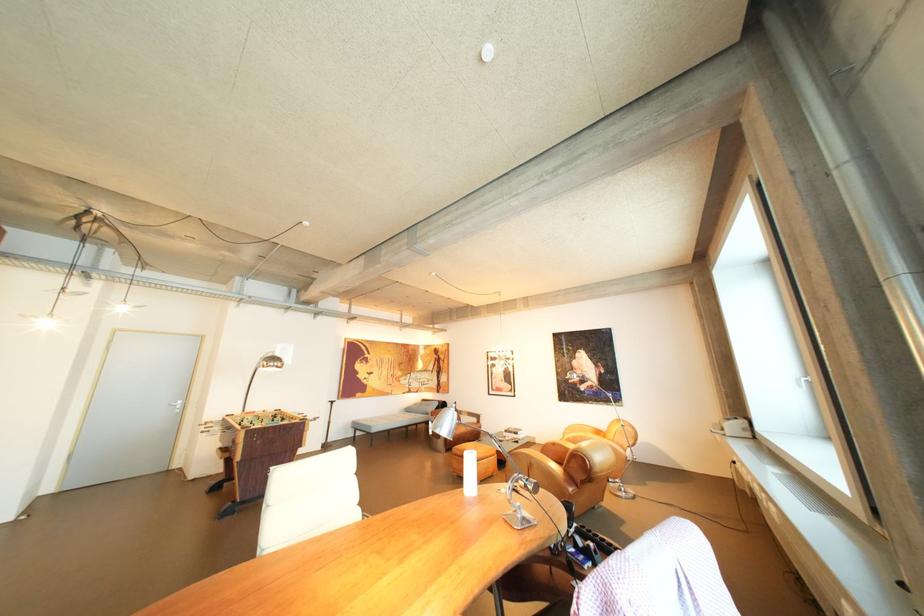
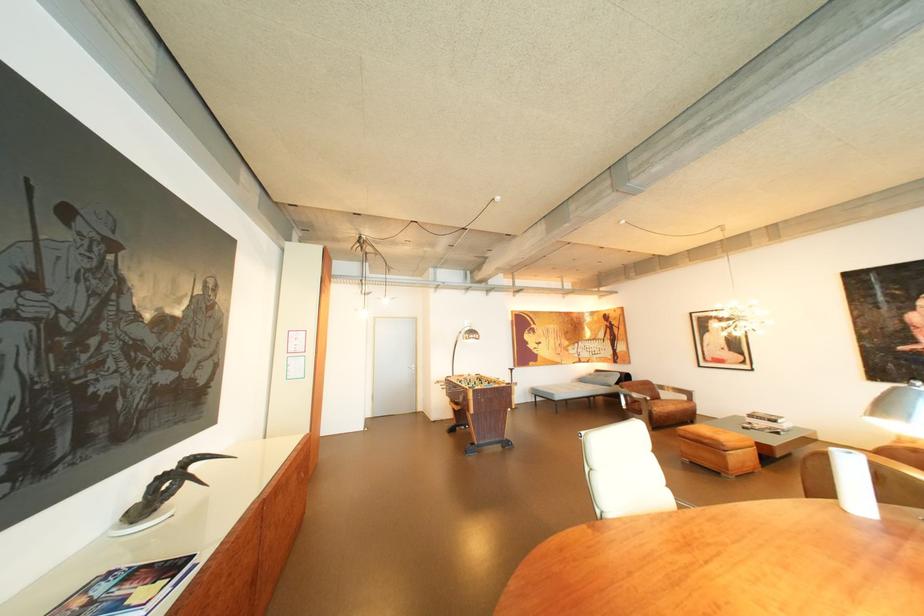
Find the pixel in the second image that matches point (519, 432) in the first image.

(763, 416)